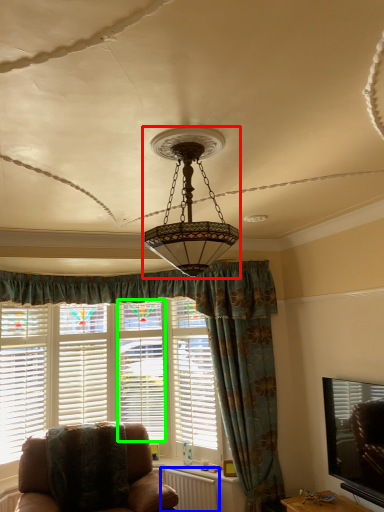
Question: Which object is the farthest from lamp (highlighted by a red box)? Choose among these: radiator (highlighted by a blue box) or shutter (highlighted by a green box).

Choices:
 (A) radiator
 (B) shutter

Answer: (A)